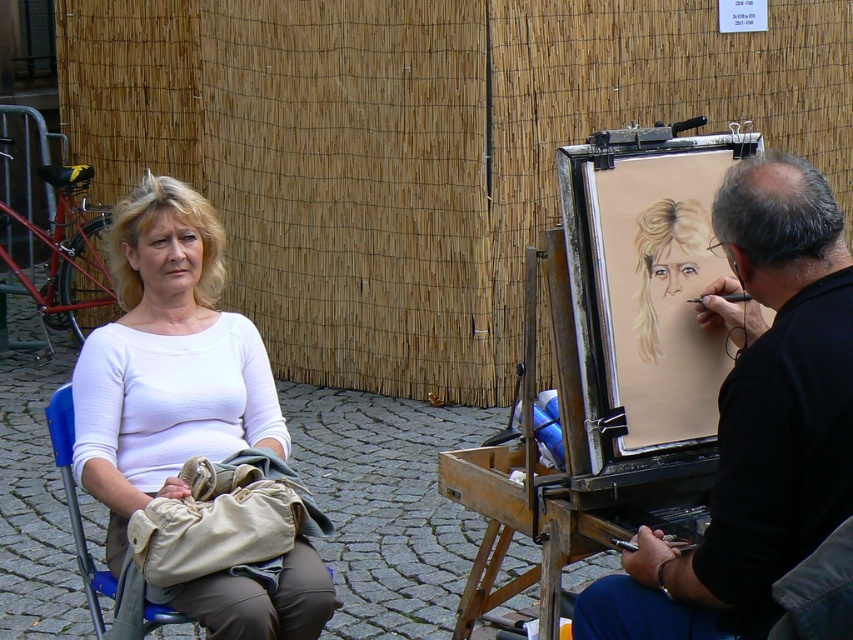
Does wooden easel at center appear over white matte shirt at left?

Incorrect, wooden easel at center is not positioned above white matte shirt at left.

Measure the distance between wooden easel at center and camera.

A distance of 3.91 meters exists between wooden easel at center and camera.

At what (x,y) coordinates should I click in order to perform the action: click on wooden easel at center. Please return your answer as a coordinate pair (x, y). Looking at the image, I should click on (608, 362).

Who is lower down, smooth black shirt at right or white matte shirt at left?

smooth black shirt at right

Can you confirm if smooth black shirt at right is taller than white matte shirt at left?

Indeed, smooth black shirt at right has a greater height compared to white matte shirt at left.

The image size is (853, 640). Find the location of `smooth black shirt at right`. smooth black shirt at right is located at coordinates (756, 419).

Which of these two, white matte shirt at left or blue plastic chair at lower left, stands taller?

With more height is white matte shirt at left.

Measure the distance between white matte shirt at left and blue plastic chair at lower left.

They are 12.84 inches apart.

Is point (136, 428) less distant than point (83, 552)?

Yes, it is in front of point (83, 552).

This screenshot has height=640, width=853. I want to click on white matte shirt at left, so click(166, 360).